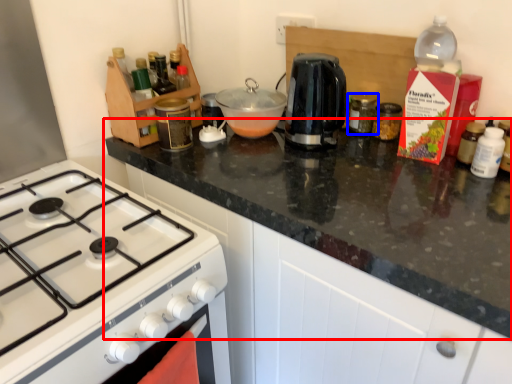
Question: Which of the following is the farthest to the observer, countertop (highlighted by a red box) or kitchen appliance (highlighted by a blue box)?

Choices:
 (A) countertop
 (B) kitchen appliance

Answer: (B)